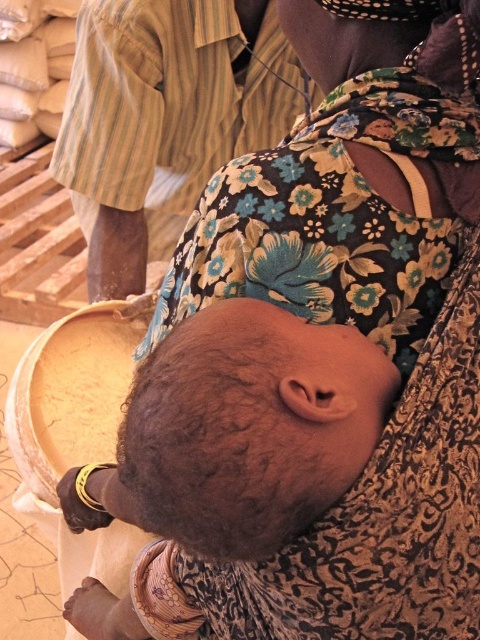
Who is higher up, dark brown hair at center or striped cotton shirt at upper left?

striped cotton shirt at upper left is above.

Which is more to the left, dark brown hair at center or striped cotton shirt at upper left?

striped cotton shirt at upper left is more to the left.

Find the location of a particular element. The height and width of the screenshot is (640, 480). dark brown hair at center is located at coordinates (247, 428).